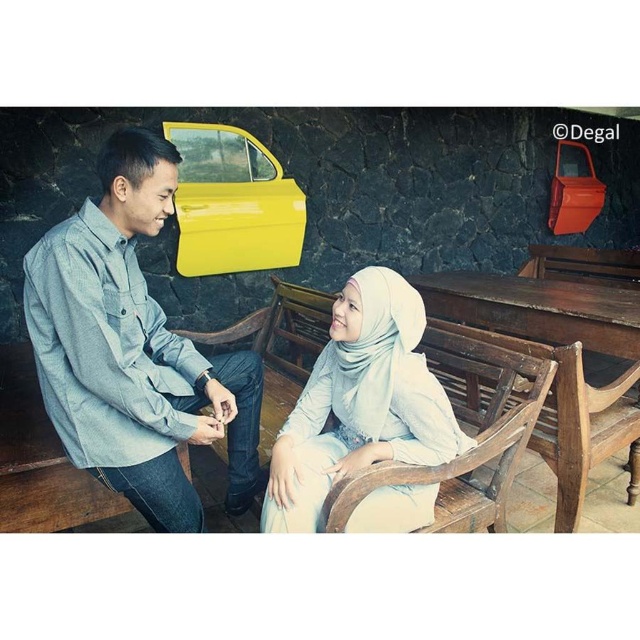
Question: Does light gray denim shirt at left come in front of yellow matte car door at upper center?

Choices:
 (A) no
 (B) yes

Answer: (B)

Question: Which point appears closest to the camera in this image?

Choices:
 (A) (276, 476)
 (B) (124, 321)
 (C) (276, 186)

Answer: (B)

Question: Is light gray denim shirt at left wider than light blue fabric hijab at center?

Choices:
 (A) no
 (B) yes

Answer: (A)

Question: Estimate the real-world distances between objects in this image. Which object is farther from the light gray denim shirt at left?

Choices:
 (A) light blue fabric hijab at center
 (B) yellow matte car door at upper center

Answer: (B)

Question: Can you confirm if light gray denim shirt at left is positioned to the right of light blue fabric hijab at center?

Choices:
 (A) no
 (B) yes

Answer: (A)

Question: Which of these objects is positioned farthest from the light blue fabric hijab at center?

Choices:
 (A) yellow matte car door at upper center
 (B) light gray denim shirt at left

Answer: (A)